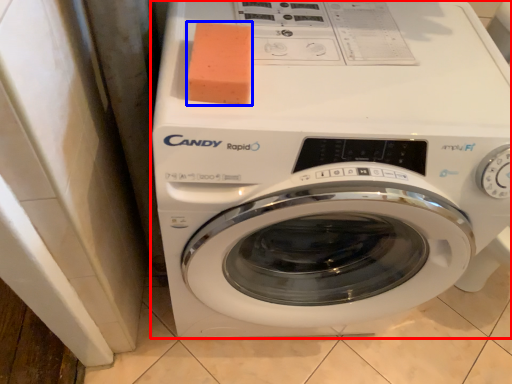
Question: Which object is further to the camera taking this photo, washing machine (highlighted by a red box) or soap (highlighted by a blue box)?

Choices:
 (A) washing machine
 (B) soap

Answer: (B)